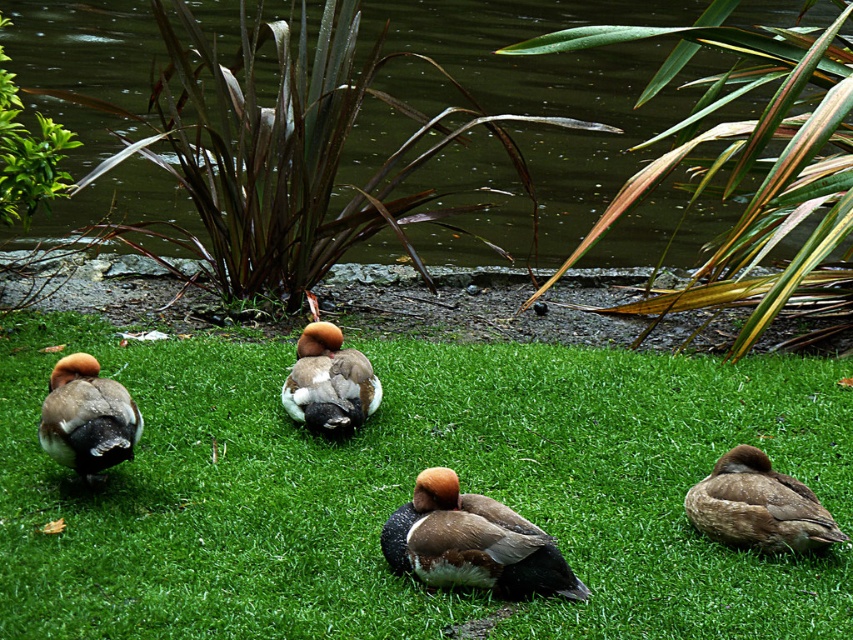
Question: Considering the relative positions of brown matte duck at center and brown fuzzy duck at lower right in the image provided, where is brown matte duck at center located with respect to brown fuzzy duck at lower right?

Choices:
 (A) below
 (B) above

Answer: (A)

Question: Which object appears farthest from the camera in this image?

Choices:
 (A) green grassy at center
 (B) brown fuzzy duck at lower left
 (C) brown fuzzy duck at center
 (D) brown fuzzy duck at lower right

Answer: (C)

Question: Which object is positioned closest to the brown fuzzy duck at lower left?

Choices:
 (A) brown fuzzy duck at center
 (B) brown fuzzy duck at lower right
 (C) green grassy at center

Answer: (C)

Question: Is green grassy at center in front of brown matte duck at center?

Choices:
 (A) no
 (B) yes

Answer: (B)

Question: Which object is closer to the camera taking this photo?

Choices:
 (A) brown matte duck at center
 (B) greenish water at center
 (C) green grassy at center

Answer: (C)

Question: Does brown matte duck at center appear on the left side of brown fuzzy duck at center?

Choices:
 (A) no
 (B) yes

Answer: (A)